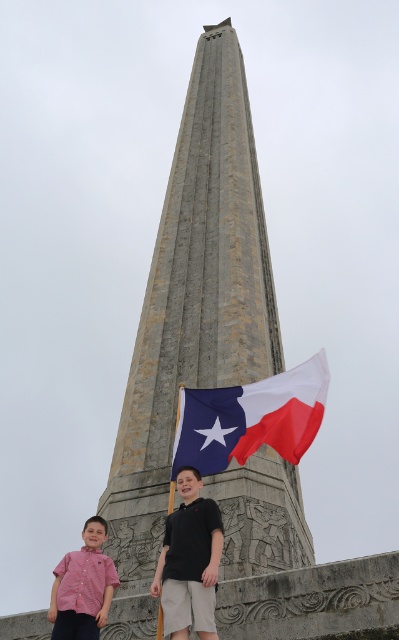
You are standing in front of the monument and want to take a photo of both the gray stone tower at center and the black cotton shirt at center. Which object should you position to your left to include both in the frame?

You should position the black cotton shirt at center to your left since the gray stone tower at center is to the right of it, ensuring both are included in the frame.

You are a photographer trying to capture both the pink cotton shirt at lower left and the red checkered shirt at lower left in the same frame. Which shirt should you focus on first to ensure both are in the frame?

You should focus on the pink cotton shirt at lower left first because it is thinner and closer to the camera than the red checkered shirt at lower left, ensuring both are in the frame.